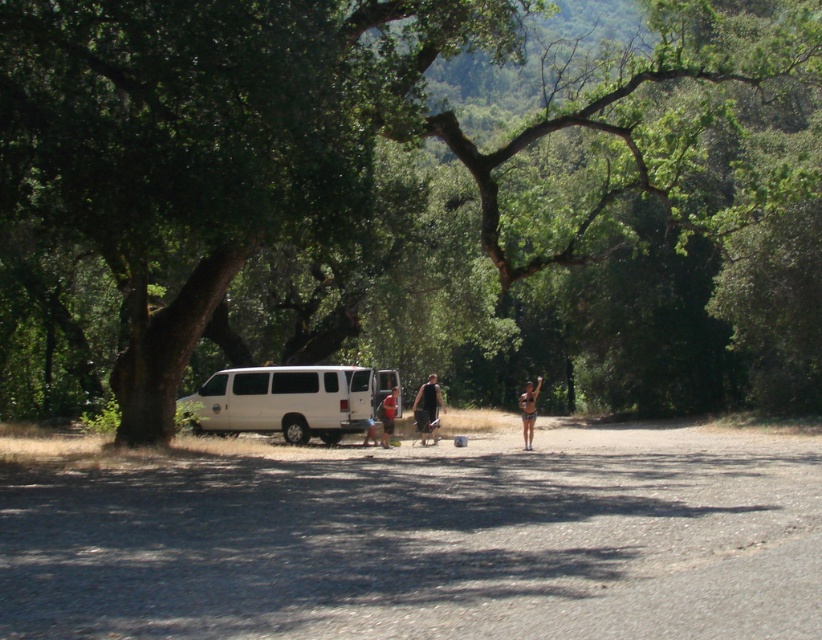
Question: Which point appears closest to the camera in this image?

Choices:
 (A) (276, 243)
 (B) (428, 401)

Answer: (A)

Question: Does green leafy tree at center have a greater width compared to white matte van at center?

Choices:
 (A) yes
 (B) no

Answer: (A)

Question: Which point appears closest to the camera in this image?

Choices:
 (A) click(x=613, y=196)
 (B) click(x=419, y=424)
 (C) click(x=229, y=374)

Answer: (B)

Question: Is the position of tan skin bikini at center more distant than that of orange fabric shirt at center?

Choices:
 (A) no
 (B) yes

Answer: (A)

Question: Which object is closer to the camera taking this photo?

Choices:
 (A) orange fabric shirt at center
 (B) black fabric shorts at center
 (C) white matte van at center
 (D) green leafy tree at center

Answer: (D)

Question: Is white matte van at center wider than tan skin bikini at center?

Choices:
 (A) yes
 (B) no

Answer: (B)